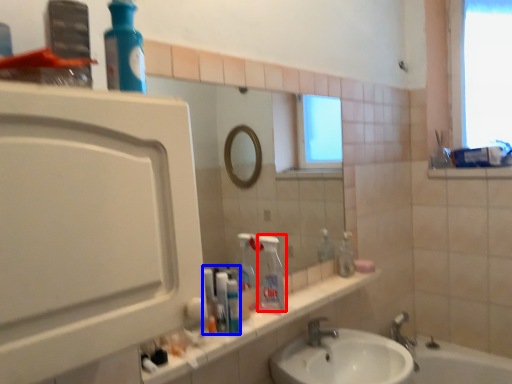
Question: Which object is further to the camera taking this photo, cleaning product (highlighted by a red box) or toiletry (highlighted by a blue box)?

Choices:
 (A) cleaning product
 (B) toiletry

Answer: (A)